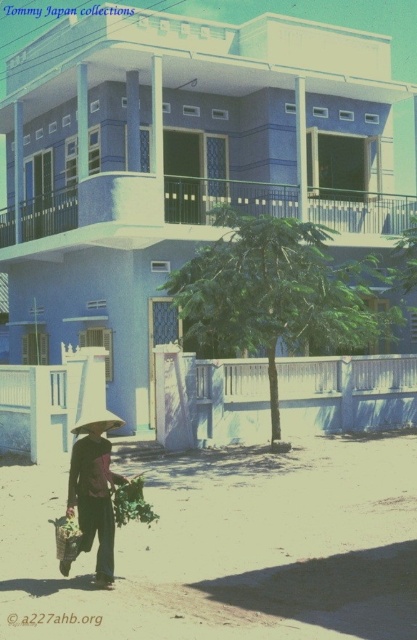
You are a photographer trying to capture the brown woven basket at lower left and the green leafy plant at lower center in the same frame. Since the person is walking away, will the basket block the view of the plant in your photo?

The brown woven basket at lower left is in front of the green leafy plant at lower center, so yes, the basket will block the view of the plant in your photo.

You are standing at the center of the image and want to pick up the green leafy plant at lower center. According to the coordinates provided, in which direction should you move to reach it?

The green leafy plant at lower center is located at coordinates point (130,502). Since you are at the center, you should move to the right and slightly downward to reach it.